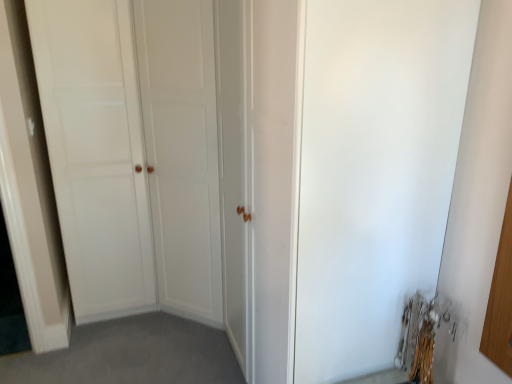
What do you see at coordinates (375, 172) in the screenshot? I see `white matte screen door at center` at bounding box center [375, 172].

Where is `white matte screen door at center`? white matte screen door at center is located at coordinates (375, 172).

The width and height of the screenshot is (512, 384). In order to click on white matte door at center in this screenshot , I will do `click(95, 152)`.

What do you see at coordinates (95, 152) in the screenshot?
I see `white matte door at center` at bounding box center [95, 152].

Image resolution: width=512 pixels, height=384 pixels. Identify the location of white matte screen door at center. (375, 172).

Which is more to the left, white matte screen door at center or white matte door at center?

From the viewer's perspective, white matte door at center appears more on the left side.

Considering the positions of objects white matte screen door at center and white matte door at center in the image provided, who is behind, white matte screen door at center or white matte door at center?

white matte door at center is more distant.

Which is behind, point (333, 73) or point (108, 73)?

Point (108, 73)

Looking at this image, from the image's perspective, is white matte screen door at center under white matte door at center?

Yes, from the image's perspective, white matte screen door at center is below white matte door at center.

Based on the photo, from a real-world perspective, which is physically below, white matte screen door at center or white matte door at center?

white matte screen door at center is physically lower.

Does white matte screen door at center have a greater width compared to white matte door at center?

In fact, white matte screen door at center might be narrower than white matte door at center.

In terms of height, does white matte screen door at center look taller or shorter compared to white matte door at center?

Considering their sizes, white matte screen door at center has less height than white matte door at center.

Considering the relative sizes of white matte screen door at center and white matte door at center in the image provided, is white matte screen door at center smaller than white matte door at center?

Yes, white matte screen door at center is smaller than white matte door at center.

Is white matte screen door at center spatially inside white matte door at center, or outside of it?

The correct answer is: outside.

Is the surface of white matte screen door at center in direct contact with white matte door at center?

white matte screen door at center and white matte door at center are not in contact.

Based on the photo, is white matte screen door at center oriented towards white matte door at center?

No.

What's the angular difference between white matte screen door at center and white matte door at center's facing directions?

The angle between the facing direction of white matte screen door at center and the facing direction of white matte door at center is 90 degrees.

How much distance is there between white matte screen door at center and white matte door at center?

white matte screen door at center and white matte door at center are 1.51 meters apart.

Locate an element on the screen. This screenshot has height=384, width=512. screen door below the white matte door at center (from the image's perspective) is located at coordinates (375, 172).

Considering the relative positions of white matte door at center and white matte screen door at center in the image provided, is white matte door at center to the left of white matte screen door at center from the viewer's perspective?

Indeed, white matte door at center is positioned on the left side of white matte screen door at center.

Does white matte door at center lie behind white matte screen door at center?

Yes, the depth of white matte door at center is greater than that of white matte screen door at center.

Considering the positions of points (138, 160) and (303, 217), is point (138, 160) closer to camera compared to point (303, 217)?

No, (138, 160) is further to viewer.

From the image's perspective, is white matte door at center above white matte screen door at center?

Correct, white matte door at center appears higher than white matte screen door at center in the image.

From a real-world perspective, relative to white matte screen door at center, is white matte door at center vertically above or below?

From a real-world perspective, white matte door at center is physically above white matte screen door at center.

Considering the relative sizes of white matte door at center and white matte screen door at center in the image provided, is white matte door at center thinner than white matte screen door at center?

No, white matte door at center is not thinner than white matte screen door at center.

From their relative heights in the image, would you say white matte door at center is taller or shorter than white matte screen door at center?

In the image, white matte door at center appears to be taller than white matte screen door at center.

Is white matte door at center bigger or smaller than white matte screen door at center?

In the image, white matte door at center appears to be larger than white matte screen door at center.

Would you say white matte door at center is inside or outside white matte screen door at center?

white matte door at center is located beyond the bounds of white matte screen door at center.

Can you see white matte door at center touching white matte screen door at center?

No.

Is white matte door at center oriented towards white matte screen door at center?

Yes.

Locate an element on the screen. This screenshot has width=512, height=384. door that is on the left side of white matte screen door at center is located at coordinates (95, 152).

Find the location of a particular element. Image resolution: width=512 pixels, height=384 pixels. door above the white matte screen door at center (from the image's perspective) is located at coordinates (95, 152).

This screenshot has height=384, width=512. What are the coordinates of `screen door below the white matte door at center (from a real-world perspective)` in the screenshot? It's located at (375, 172).